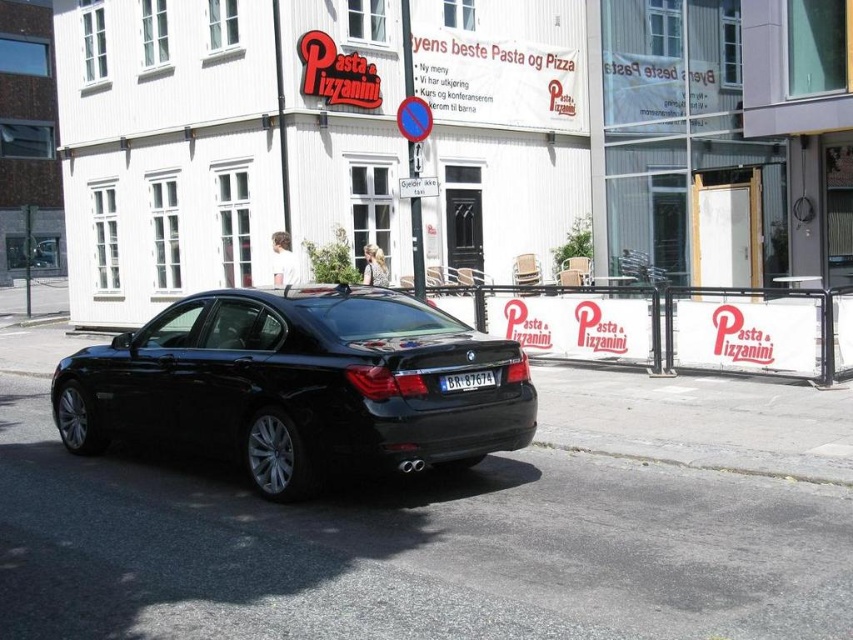
You are a delivery person approaching the white building with the restaurant sign. You need to park your vehicle but there is a black metallic car at center blocking the entrance. Can you drive around the car to reach the white plastic barrier at center for parking?

The black metallic car at center is closer to the viewer than the white plastic barrier at center, so you can drive around the car to reach the white plastic barrier at center for parking since the barrier is further away.

You are standing 2 meters away from a black metallic car at center. Can you safely walk around it without getting too close?

The distance between you and the black metallic car at center is 5.30 meters, so yes, you can safely walk around it without getting too close.